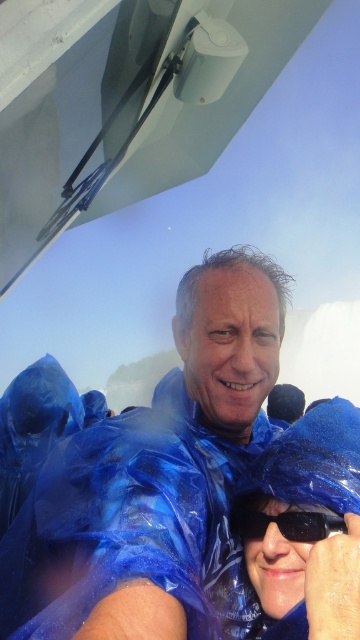
You are a tour guide organizing a group photo on a tour bus. You notice the blue plastic poncho at center and the black plastic goggles at center. Which object is positioned higher in the image?

The blue plastic poncho at center is taller than the black plastic goggles at center, so the blue plastic poncho at center is positioned higher in the image.

You are a tour guide on a rainy day and need to check if the blue plastic poncho at center can fully cover the black plastic goggles at center. Based on their sizes, will the poncho be wide enough to cover the goggles?

The blue plastic poncho at center is wider than the black plastic goggles at center, so yes, the poncho can fully cover the goggles.